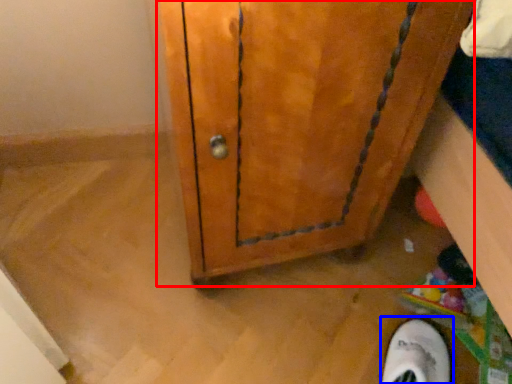
Question: Which of the following is the closest to the observer, door (highlighted by a red box) or footwear (highlighted by a blue box)?

Choices:
 (A) door
 (B) footwear

Answer: (A)